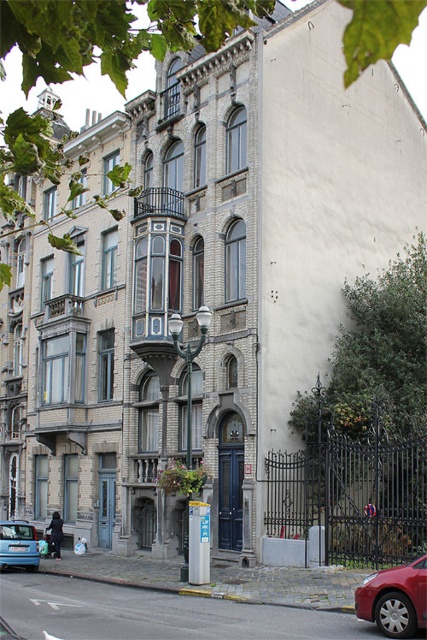
Question: Observing the image, what is the correct spatial positioning of shiny red car at lower right in reference to blue matte hatchback at lower left?

Choices:
 (A) above
 (B) below

Answer: (A)

Question: Which point is farther to the camera?

Choices:
 (A) click(x=22, y=536)
 (B) click(x=391, y=600)

Answer: (A)

Question: Observing the image, what is the correct spatial positioning of shiny red car at lower right in reference to blue matte hatchback at lower left?

Choices:
 (A) left
 (B) right

Answer: (B)

Question: Is the position of shiny red car at lower right more distant than that of blue matte hatchback at lower left?

Choices:
 (A) yes
 (B) no

Answer: (B)

Question: Which point appears farthest from the camera in this image?

Choices:
 (A) (406, 573)
 (B) (18, 522)

Answer: (B)